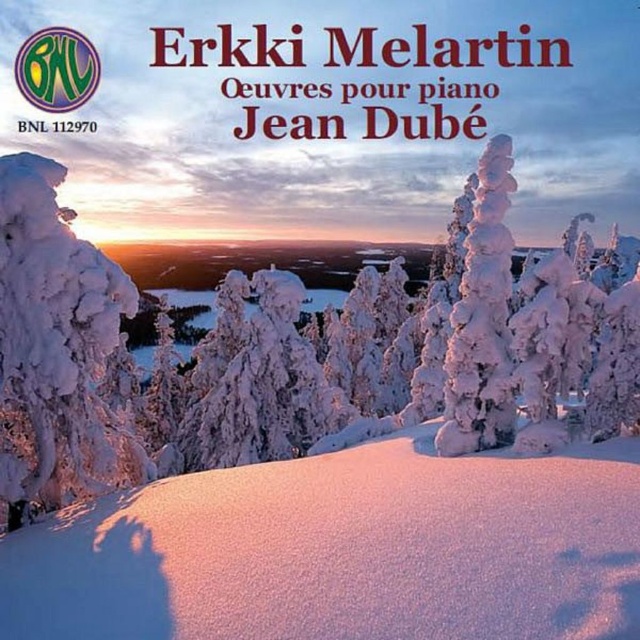
Question: Which of the following is the closest to the observer?

Choices:
 (A) [x=49, y=250]
 (B) [x=218, y=632]

Answer: (B)

Question: Which object appears farthest from the camera in this image?

Choices:
 (A) white fluffy snow at center
 (B) white frosty tree at left

Answer: (B)

Question: Is white fluffy snow at center below white frosty tree at left?

Choices:
 (A) no
 (B) yes

Answer: (B)

Question: Can you confirm if white fluffy snow at center is positioned below white frosty tree at left?

Choices:
 (A) yes
 (B) no

Answer: (A)

Question: Can you confirm if white fluffy snow at center is positioned above white frosty tree at left?

Choices:
 (A) no
 (B) yes

Answer: (A)